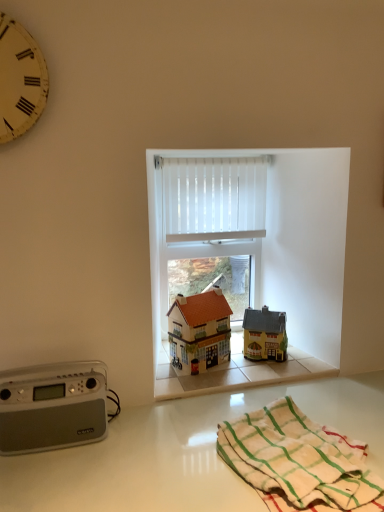
I want to click on free space to the back side of white cotton towel at lower right, so click(298, 400).